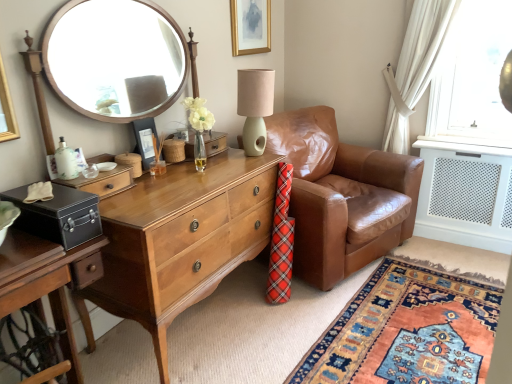
The image size is (512, 384). What do you see at coordinates (66, 161) in the screenshot? I see `white glossy bottle at left` at bounding box center [66, 161].

The height and width of the screenshot is (384, 512). Describe the element at coordinates (250, 26) in the screenshot. I see `matte gold picture frame at upper center, positioned as the second picture frame in front-to-back order` at that location.

The width and height of the screenshot is (512, 384). In order to click on carpet with intricate patterns at lower right in this screenshot , I will do `click(407, 331)`.

Does brown leather armchair at center appear on the right side of carpet with intricate patterns at lower right?

No.

Could carpet with intricate patterns at lower right be considered to be inside brown leather armchair at center?

Actually, carpet with intricate patterns at lower right is outside brown leather armchair at center.

Who is bigger, brown leather armchair at center or carpet with intricate patterns at lower right?

Bigger between the two is brown leather armchair at center.

Considering the sizes of objects brown leather armchair at center and carpet with intricate patterns at lower right in the image provided, who is thinner, brown leather armchair at center or carpet with intricate patterns at lower right?

carpet with intricate patterns at lower right is thinner.

Considering the sizes of objects matte brown drawer at center and brown leather armchair at center in the image provided, who is thinner, matte brown drawer at center or brown leather armchair at center?

Thinner between the two is matte brown drawer at center.

Is matte brown drawer at center beside brown leather armchair at center?

No, matte brown drawer at center is not touching brown leather armchair at center.

Does matte brown drawer at center come in front of brown leather armchair at center?

Yes, matte brown drawer at center is closer to the camera.

Considering the sizes of matte brown drawer at center and brown leather armchair at center in the image, is matte brown drawer at center taller or shorter than brown leather armchair at center?

In the image, matte brown drawer at center appears to be shorter than brown leather armchair at center.

Is matte black safe at left placed right next to matte brown drawer at center?

No, matte black safe at left is not touching matte brown drawer at center.

Could you tell me if matte black safe at left is turned towards matte brown drawer at center?

No, matte black safe at left does not turn towards matte brown drawer at center.

Which is more to the right, matte black safe at left or matte brown drawer at center?

matte brown drawer at center.

Does point (62, 339) lie in front of point (97, 176)?

Yes, point (62, 339) is in front of point (97, 176).

From a real-world perspective, is white glossy bottle at left on carpet with intricate patterns at lower right?

Yes, from a real-world perspective, white glossy bottle at left is above carpet with intricate patterns at lower right.

From the image's perspective, which one is positioned lower, white glossy bottle at left or carpet with intricate patterns at lower right?

carpet with intricate patterns at lower right is shown below in the image.

Is white glossy bottle at left aimed at carpet with intricate patterns at lower right?

No.

Considering the positions of objects light brown wood desk at center and matte brown drawer at center in the image provided, who is more to the left, light brown wood desk at center or matte brown drawer at center?

matte brown drawer at center.

From the image's perspective, would you say light brown wood desk at center is positioned over matte brown drawer at center?

No, from the image's perspective, light brown wood desk at center is not on top of matte brown drawer at center.

Would you say light brown wood desk at center is a long distance from matte brown drawer at center?

No, light brown wood desk at center is in close proximity to matte brown drawer at center.

Is white glossy bottle at left inside the boundaries of black matte picture frame at center, arranged as the 1th picture frame when viewed from the front, or outside?

white glossy bottle at left exists outside the volume of black matte picture frame at center, arranged as the 1th picture frame when viewed from the front.

Can you tell me how much white glossy bottle at left and black matte picture frame at center, which is the first picture frame from bottom to top, differ in facing direction?

0.615 degrees.

Locate an element on the screen. bottle below the black matte picture frame at center, which is counted as the 2th picture frame, starting from the top (from the image's perspective) is located at coordinates (66, 161).

Would you say white glossy bottle at left is to the left or to the right of black matte picture frame at center, the second picture frame positioned from the back, in the picture?

In the image, white glossy bottle at left appears on the left side of black matte picture frame at center, the second picture frame positioned from the back.

In terms of height, does mint green ceramic table lamp at center look taller or shorter compared to brown leather armchair at center?

mint green ceramic table lamp at center is shorter than brown leather armchair at center.

Is point (269, 79) farther from viewer compared to point (330, 190)?

No, (269, 79) is in front of (330, 190).

Is mint green ceramic table lamp at center facing towards brown leather armchair at center?

No, mint green ceramic table lamp at center is not turned towards brown leather armchair at center.

Which object is wider, mint green ceramic table lamp at center or brown leather armchair at center?

Wider between the two is brown leather armchair at center.

Identify the location of plain directly beneath the brown leather armchair at center (from a real-world perspective). (407, 331).

Locate an element on the screen. chair behind the matte brown drawer at center is located at coordinates (341, 196).

Which object lies nearer to the anchor point matte brown drawer at center, matte gold picture frame at upper center, the first picture frame in the back-to-front sequence, or carpet with intricate patterns at lower right?

matte gold picture frame at upper center, the first picture frame in the back-to-front sequence, is positioned closer to the anchor matte brown drawer at center.

From the image, which object appears to be nearer to matte black safe at left, white glossy bottle at left or carpet with intricate patterns at lower right?

white glossy bottle at left lies closer to matte black safe at left than the other object.

When comparing their distances from black matte picture frame at center, positioned as the first picture frame in left-to-right order, does light brown wood desk at center or matte gold picture frame at upper center, the first picture frame in the back-to-front sequence, seem further?

matte gold picture frame at upper center, the first picture frame in the back-to-front sequence.

Based on their spatial positions, is black matte picture frame at center, which is the first picture frame from bottom to top, or matte gold picture frame at upper center, acting as the 2th picture frame starting from the bottom, further from light brown wood desk at center?

The object further to light brown wood desk at center is matte gold picture frame at upper center, acting as the 2th picture frame starting from the bottom.

When comparing their distances from matte gold picture frame at upper center, which is the second picture frame from left to right, does carpet with intricate patterns at lower right or brown leather armchair at center seem closer?

The object closer to matte gold picture frame at upper center, which is the second picture frame from left to right, is brown leather armchair at center.

When comparing their distances from white glossy bottle at left, does brown leather armchair at center or matte black safe at left seem closer?

matte black safe at left.

When comparing their distances from matte black safe at left, does carpet with intricate patterns at lower right or matte brown drawer at center seem further?

carpet with intricate patterns at lower right lies further to matte black safe at left than the other object.

Which object lies nearer to the anchor point mint green ceramic table lamp at center, black matte picture frame at center, arranged as the 1th picture frame when viewed from the front, or light brown wood desk at center?

Based on the image, black matte picture frame at center, arranged as the 1th picture frame when viewed from the front, appears to be nearer to mint green ceramic table lamp at center.

This screenshot has height=384, width=512. What are the coordinates of `bottle between matte gold picture frame at upper center, positioned as the second picture frame in front-to-back order, and matte brown drawer at center vertically` in the screenshot? It's located at (66, 161).

At what (x,y) coordinates should I click in order to perform the action: click on drawer between white glossy bottle at left and mint green ceramic table lamp at center from left to right. Please return your answer as a coordinate pair (x, y). Looking at the image, I should click on (103, 182).

Identify the location of drawer between mint green ceramic table lamp at center and matte black safe at left vertically. (103, 182).

This screenshot has height=384, width=512. I want to click on desk between mint green ceramic table lamp at center and carpet with intricate patterns at lower right from top to bottom, so coord(180,240).